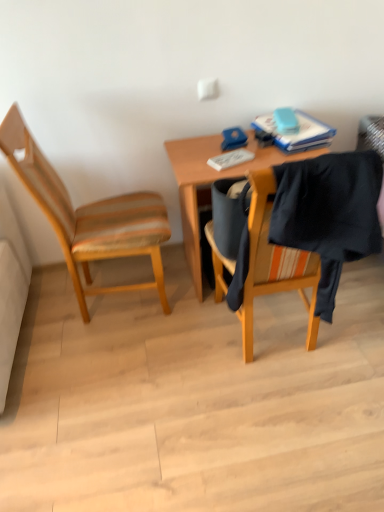
At what (x,y) coordinates should I click in order to perform the action: click on free location in front of wooden chair at left. Please return your answer as a coordinate pair (x, y). Image resolution: width=384 pixels, height=512 pixels. Looking at the image, I should click on 126,369.